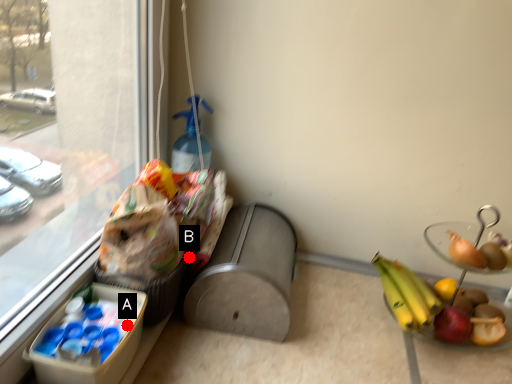
Question: Two points are circled on the image, labeled by A and B beside each circle. Which point is closer to the camera taking this photo?

Choices:
 (A) A is closer
 (B) B is closer

Answer: (A)